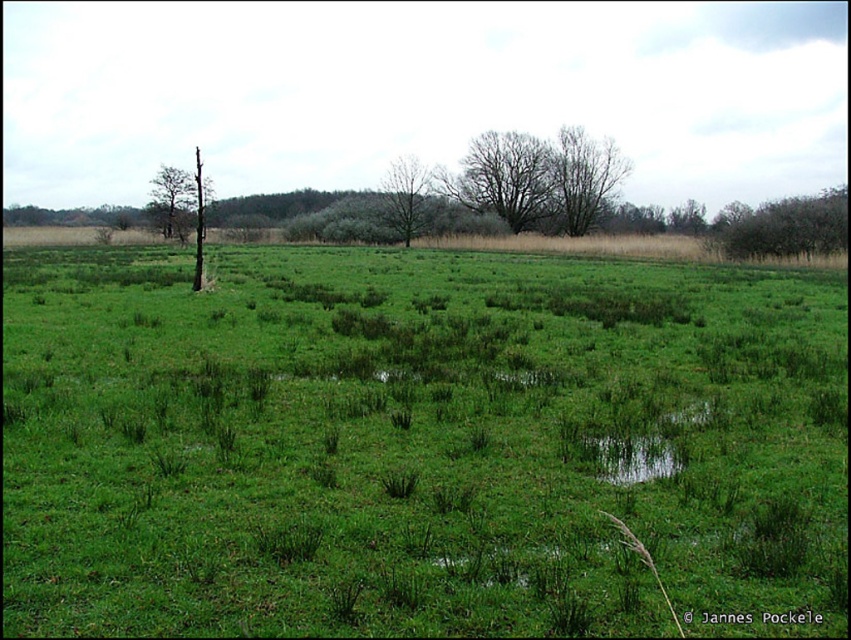
Who is more distant from viewer, (741, 232) or (393, 228)?

Positioned behind is point (393, 228).

Is point (762, 232) positioned before point (421, 168)?

Yes, it is.

Find the location of a particular element. Image resolution: width=851 pixels, height=640 pixels. dark green textured tree at upper right is located at coordinates (781, 227).

Can you confirm if bare branches at center is smaller than dark green textured tree at upper right?

Yes.

Between bare branches at center and dark green textured tree at upper right, which one appears on the right side from the viewer's perspective?

Positioned to the right is dark green textured tree at upper right.

The image size is (851, 640). Identify the location of bare branches at center. (504, 179).

Is point (427, 176) farther from viewer compared to point (184, 195)?

No, (427, 176) is in front of (184, 195).

Who is more forward, (414, 196) or (187, 177)?

Point (414, 196) is more forward.

Where is `bare tree at center`? This screenshot has height=640, width=851. bare tree at center is located at coordinates (406, 196).